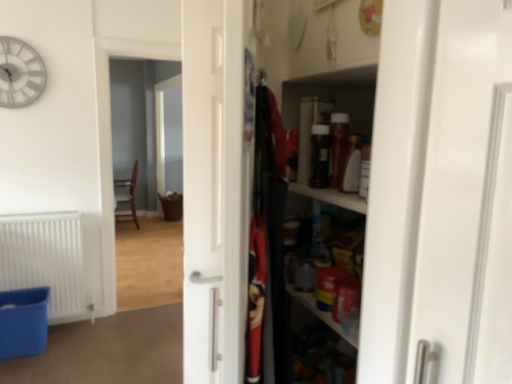
The width and height of the screenshot is (512, 384). Find the location of `white matte radiator at lower left`. white matte radiator at lower left is located at coordinates (46, 261).

Describe the element at coordinates (137, 124) in the screenshot. This screenshot has height=384, width=512. I see `wooden chair at center` at that location.

What do you see at coordinates (23, 322) in the screenshot? I see `blue plastic laundry basket at lower left` at bounding box center [23, 322].

Measure the distance between point (402, 171) and camera.

Point (402, 171) is 75.10 centimeters from camera.

This screenshot has width=512, height=384. I want to click on white matte radiator at lower left, so click(x=46, y=261).

Does point (129, 89) come behind point (66, 237)?

Yes.

Find the location of a particular element. This screenshot has width=512, height=384. corridor above the white matte radiator at lower left (from the image's perspective) is located at coordinates (137, 124).

From the image's perspective, is wooden chair at center under white matte radiator at lower left?

No, from the image's perspective, wooden chair at center is not below white matte radiator at lower left.

Would you consider blue plastic laundry basket at lower left to be distant from metallic clock at upper left?

Absolutely, blue plastic laundry basket at lower left is distant from metallic clock at upper left.

From the image's perspective, which one is positioned lower, blue plastic laundry basket at lower left or metallic clock at upper left?

blue plastic laundry basket at lower left.

Considering the sizes of blue plastic laundry basket at lower left and metallic clock at upper left in the image, is blue plastic laundry basket at lower left wider or thinner than metallic clock at upper left?

Clearly, blue plastic laundry basket at lower left has more width compared to metallic clock at upper left.

Is point (37, 342) in front of point (34, 65)?

Yes, it is in front of point (34, 65).

In terms of size, does brown woven basket at center appear bigger or smaller than blue plastic laundry basket at lower left?

In the image, brown woven basket at center appears to be larger than blue plastic laundry basket at lower left.

Measure the distance from brown woven basket at center to blue plastic laundry basket at lower left.

4.41 meters.

Is point (166, 154) closer or farther from the camera than point (31, 354)?

Point (166, 154).

Based on the photo, from the image's perspective, does brown woven basket at center appear lower than blue plastic laundry basket at lower left?

No, from the image's perspective, brown woven basket at center is not beneath blue plastic laundry basket at lower left.

Is metallic clock at upper left next to brown woven basket at center and touching it?

No, metallic clock at upper left is not beside brown woven basket at center.

Who is more distant, metallic clock at upper left or brown woven basket at center?

brown woven basket at center.

Does point (33, 74) come behind point (157, 143)?

No, it is in front of (157, 143).

Consider the image. Choose the correct answer: Is metallic clock at upper left inside brown woven basket at center or outside it?

metallic clock at upper left exists outside the volume of brown woven basket at center.

Is wooden shelves at right taller than wooden chair at left?

Yes, wooden shelves at right is taller than wooden chair at left.

Consider the image. Is the surface of wooden shelves at right in direct contact with wooden chair at left?

No.

Based on the photo, from the image's perspective, is wooden shelves at right on top of wooden chair at left?

Incorrect, from the image's perspective, wooden shelves at right is lower than wooden chair at left.

At what (x,y) coordinates should I click in order to perform the action: click on dresser that appears on the right of wooden chair at left. Please return your answer as a coordinate pair (x, y). This screenshot has height=384, width=512. Looking at the image, I should click on (396, 186).

From a real-world perspective, is wooden shelves at right physically below wooden chair at center?

No, from a real-world perspective, wooden shelves at right is not below wooden chair at center.

Does wooden shelves at right have a lesser height compared to wooden chair at center?

Indeed, wooden shelves at right has a lesser height compared to wooden chair at center.

Is point (391, 188) behind point (116, 121)?

No, it is not.

Is brown woven basket at center far from wooden chair at left?

No, brown woven basket at center is not far from wooden chair at left.

How different are the orientations of brown woven basket at center and wooden chair at left in degrees?

2.8 degrees.

From a real-world perspective, is brown woven basket at center positioned above or below wooden chair at left?

brown woven basket at center is above wooden chair at left.

Considering the points (159, 188) and (134, 209), which point is behind, point (159, 188) or point (134, 209)?

The point (159, 188) is more distant.

Image resolution: width=512 pixels, height=384 pixels. Identify the location of radiator on the left side of wooden chair at center. (46, 261).

Identify the location of clock that appears behind the blue plastic laundry basket at lower left. The image size is (512, 384). (20, 73).

Based on their spatial positions, is wooden chair at center or blue plastic laundry basket at lower left further from wooden shelves at right?

wooden chair at center is positioned further to the anchor wooden shelves at right.

Estimate the real-world distances between objects in this image. Which object is further from wooden chair at left, wooden chair at center or white matte radiator at lower left?

white matte radiator at lower left.

Based on their spatial positions, is blue plastic laundry basket at lower left or white matte radiator at lower left further from metallic clock at upper left?

blue plastic laundry basket at lower left is positioned further to the anchor metallic clock at upper left.

From the image, which object appears to be farther from brown woven basket at center, wooden shelves at right or metallic clock at upper left?

wooden shelves at right.

When comparing their distances from brown woven basket at center, does metallic clock at upper left or wooden chair at left seem closer?

wooden chair at left.

From the image, which object appears to be nearer to wooden chair at left, blue plastic laundry basket at lower left or brown woven basket at center?

Among the two, brown woven basket at center is located nearer to wooden chair at left.

Looking at the image, which one is located closer to white matte radiator at lower left, blue plastic laundry basket at lower left or wooden chair at center?

Based on the image, blue plastic laundry basket at lower left appears to be nearer to white matte radiator at lower left.

Considering their positions, is wooden chair at left positioned further to wooden chair at center than metallic clock at upper left?

Based on the image, metallic clock at upper left appears to be further to wooden chair at center.

The image size is (512, 384). Find the location of `radiator positioned between metallic clock at upper left and brown woven basket at center from near to far`. radiator positioned between metallic clock at upper left and brown woven basket at center from near to far is located at coordinates (46, 261).

Identify the location of corridor between metallic clock at upper left and white matte radiator at lower left vertically. (137, 124).

Identify the location of radiator between metallic clock at upper left and wooden chair at left from front to back. (46, 261).

At what (x,y) coordinates should I click in order to perform the action: click on corridor positioned between blue plastic laundry basket at lower left and wooden chair at left from near to far. Please return your answer as a coordinate pair (x, y). The height and width of the screenshot is (384, 512). Looking at the image, I should click on (137, 124).